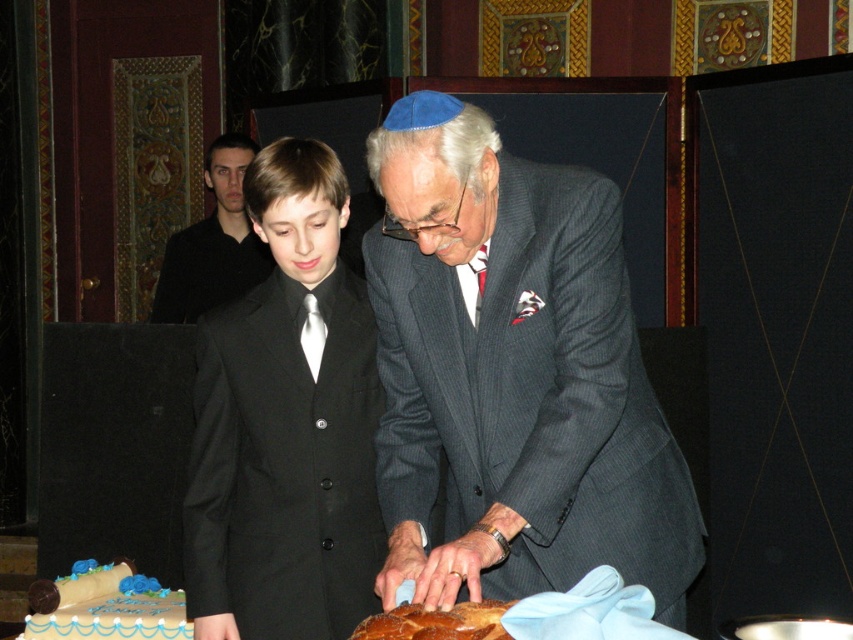
Question: Which object is the closest to the black satin suit at center?

Choices:
 (A) black suit at left
 (B) matte gray suit at center

Answer: (B)

Question: Which of these objects is positioned farthest from the black satin suit at center?

Choices:
 (A) matte gray suit at center
 (B) black suit at left
 (C) blue frosted cake at lower left

Answer: (B)

Question: Where is matte gray suit at center located in relation to blue frosted cake at lower left in the image?

Choices:
 (A) left
 (B) right

Answer: (B)

Question: Considering the relative positions of black satin suit at center and blue frosted cake at lower left in the image provided, where is black satin suit at center located with respect to blue frosted cake at lower left?

Choices:
 (A) right
 (B) left

Answer: (A)

Question: Which object appears closest to the camera in this image?

Choices:
 (A) blue frosted cake at lower left
 (B) black satin suit at center
 (C) matte gray suit at center

Answer: (C)

Question: Can you confirm if matte gray suit at center is wider than black suit at left?

Choices:
 (A) yes
 (B) no

Answer: (A)